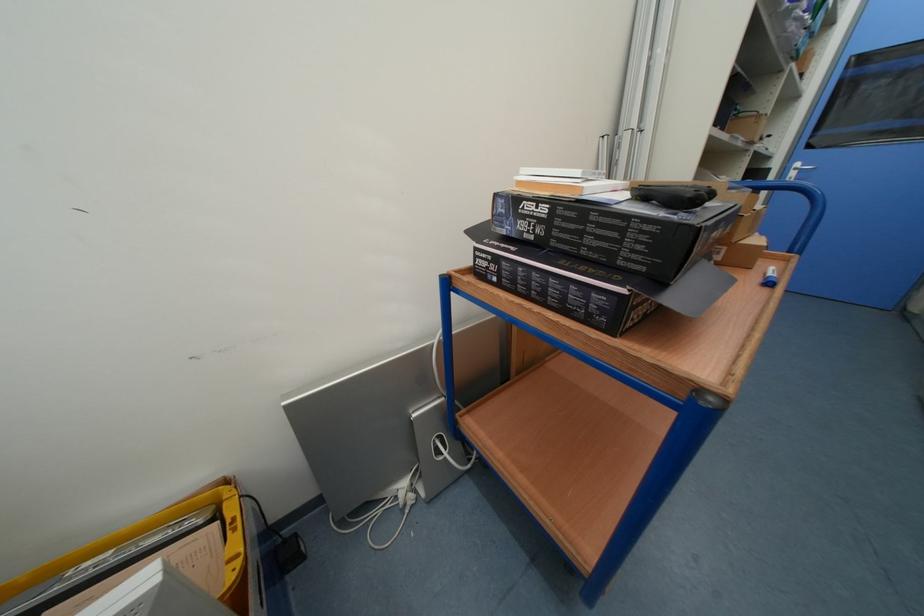
You are a GUI agent. You are given a task and a screenshot of the screen. Output one action in this format:
    pyautogui.click(x=<x>, y=<y>)
    Task: Click on the blue cart handle
    
    Given the screenshot: What is the action you would take?
    click(774, 185)